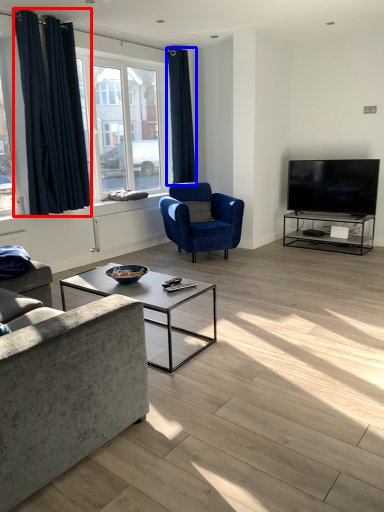
Question: Which point is closer to the camera, curtain (highlighted by a red box) or curtain (highlighted by a blue box)?

Choices:
 (A) curtain
 (B) curtain

Answer: (A)